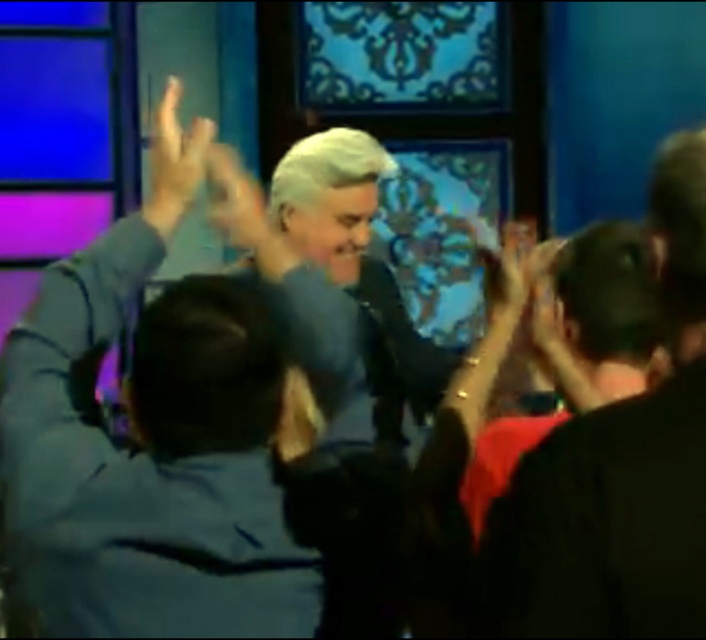
You are a stagehand who needs to place a 3 meter long banner between the light blue shirt at center and the matte yellow hand at center. Can you fit the banner between them?

The distance between the light blue shirt at center and the matte yellow hand at center is 3.19 meters. Since the banner is 3 meters long, it will fit with 0.19 meters of space remaining.

You are an assistant at an event and need to place two props on a shelf. The shelf has limited space. You have a matte black hand at upper left and a matte yellow hand at center. Which prop requires more space horizontally?

The matte yellow hand at center requires more horizontal space because it has a greater width than the matte black hand at upper left.

You are designing a poster and want to ensure the light blue shirt at center and the matte yellow hand at center are both visible. Based on their sizes, which object should be placed closer to the front for better visibility?

The light blue shirt at center might be wider than the matte yellow hand at center, so placing the light blue shirt at center closer to the front would ensure both are visible while maintaining their size proportions.